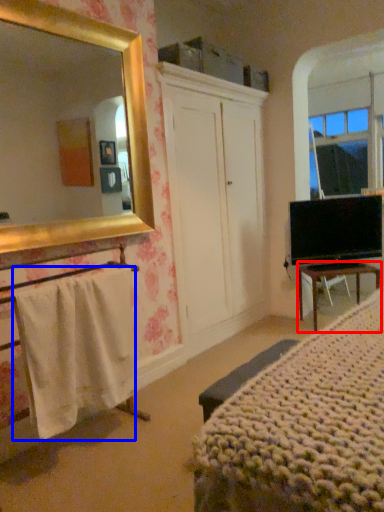
Question: Which of the following is the closest to the observer, desk (highlighted by a red box) or towel/napkin (highlighted by a blue box)?

Choices:
 (A) desk
 (B) towel/napkin

Answer: (B)